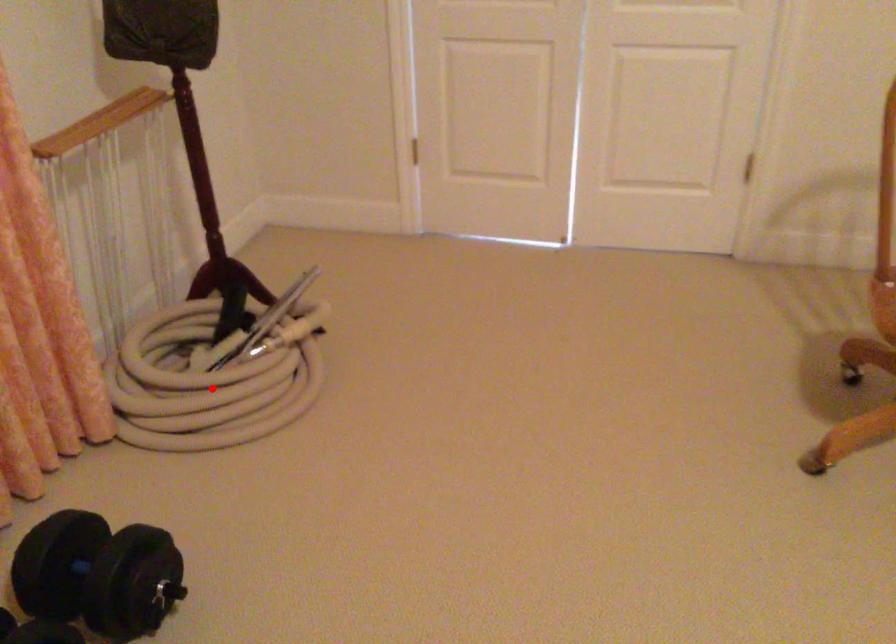
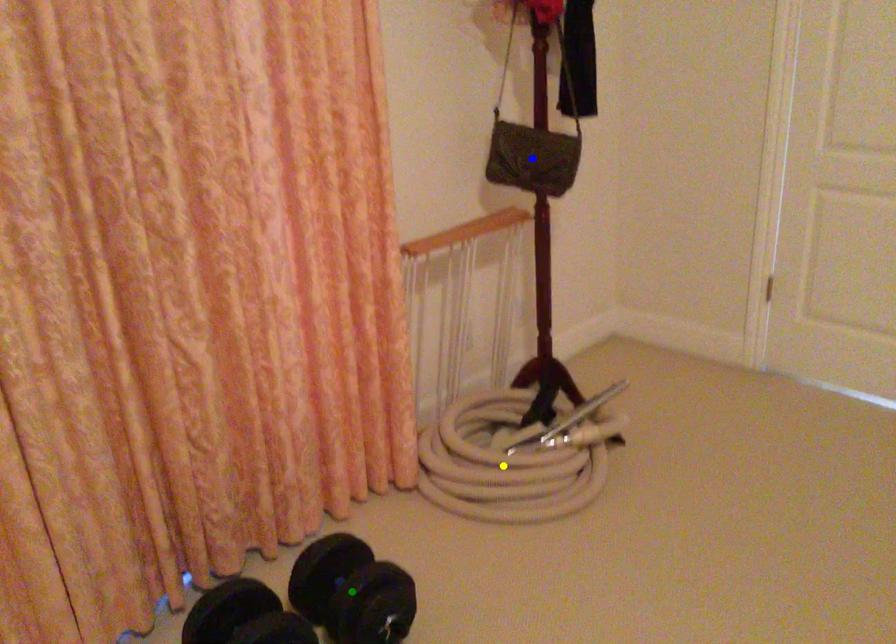
Question: I am providing you with two images of the same scene from different viewpoints. A red point is marked on the first image. You are given multiple points on the second image. Which mark in image 2 goes with the point in image 1?

Choices:
 (A) blue point
 (B) yellow point
 (C) green point

Answer: (B)